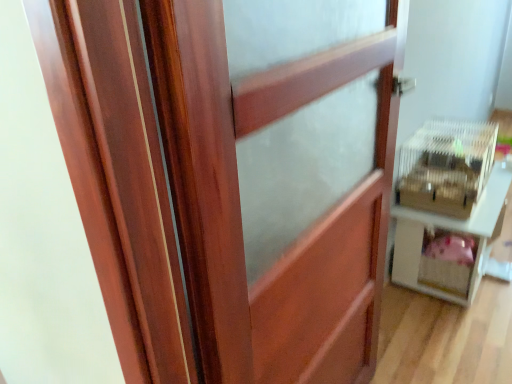
The width and height of the screenshot is (512, 384). Describe the element at coordinates (446, 166) in the screenshot. I see `clear plastic crate at right` at that location.

Identify the location of wooden barn door at center. (283, 186).

This screenshot has height=384, width=512. Find the location of `white plastic cage at right`. white plastic cage at right is located at coordinates (451, 229).

Is wooden barn door at center oriented towards white plastic cage at right?

No.

From the image's perspective, is wooden barn door at center located above or below white plastic cage at right?

Clearly, from the image's perspective, wooden barn door at center is below white plastic cage at right.

Is point (206, 295) farther from viewer compared to point (409, 274)?

No, (206, 295) is closer to viewer.

From a real-world perspective, is white plastic cage at right physically located above or below wooden barn door at center?

white plastic cage at right is situated lower than wooden barn door at center in the real world.

Can you tell me how much white plastic cage at right and wooden barn door at center differ in facing direction?

The facing directions of white plastic cage at right and wooden barn door at center are 1.28 degrees apart.

Which object is further away from the camera taking this photo, white plastic cage at right or wooden barn door at center?

white plastic cage at right is further away from the camera.

Does white plastic cage at right have a lesser width compared to wooden barn door at center?

No.

From a real-world perspective, is clear plastic crate at right physically above white plastic cage at right?

Yes, from a real-world perspective, clear plastic crate at right is above white plastic cage at right.

Is clear plastic crate at right inside or outside of white plastic cage at right?

clear plastic crate at right lies outside white plastic cage at right.

Considering the points (421, 176) and (407, 277), which point is behind, point (421, 176) or point (407, 277)?

The point (407, 277) is behind.

Which object is positioned more to the right, clear plastic crate at right or white plastic cage at right?

white plastic cage at right.

Can you tell me how much clear plastic crate at right and wooden barn door at center differ in facing direction?

The angle between the facing direction of clear plastic crate at right and the facing direction of wooden barn door at center is 1.28 degrees.

Is clear plastic crate at right inside the boundaries of wooden barn door at center, or outside?

clear plastic crate at right is not enclosed by wooden barn door at center.

Looking at this image, from a real-world perspective, who is located lower, clear plastic crate at right or wooden barn door at center?

clear plastic crate at right.

From the image's perspective, is clear plastic crate at right over wooden barn door at center?

Yes.

Are white plastic cage at right and clear plastic crate at right making contact?

No, white plastic cage at right is not in contact with clear plastic crate at right.

Considering the positions of point (473, 219) and point (452, 150), is point (473, 219) closer or farther from the camera than point (452, 150)?

Point (473, 219) is farther from the camera than point (452, 150).

Is white plastic cage at right to the left or to the right of clear plastic crate at right in the image?

Clearly, white plastic cage at right is on the right of clear plastic crate at right in the image.

From the picture: Is white plastic cage at right shorter than clear plastic crate at right?

In fact, white plastic cage at right may be taller than clear plastic crate at right.

Can you tell me how much wooden barn door at center and clear plastic crate at right differ in facing direction?

1.28 degrees separate the facing orientations of wooden barn door at center and clear plastic crate at right.

Considering the positions of point (305, 190) and point (436, 154), is point (305, 190) closer or farther from the camera than point (436, 154)?

Point (305, 190).

Can clear plastic crate at right be found inside wooden barn door at center?

Definitely not — clear plastic crate at right is not inside wooden barn door at center.

Is wooden barn door at center smaller than clear plastic crate at right?

Incorrect, wooden barn door at center is not smaller in size than clear plastic crate at right.

Find the location of a particular element. barn door below the white plastic cage at right (from the image's perspective) is located at coordinates (283, 186).

You are a GUI agent. You are given a task and a screenshot of the screen. Output one action in this format:
    pyautogui.click(x=<x>, y=<y>)
    Task: Click on the barn door lying on the left of white plastic cage at right
    
    Given the screenshot: What is the action you would take?
    pyautogui.click(x=283, y=186)

Estimate the real-world distances between objects in this image. Which object is further from white plastic cage at right, wooden barn door at center or clear plastic crate at right?

wooden barn door at center lies further to white plastic cage at right than the other object.

Considering their positions, is white plastic cage at right positioned further to wooden barn door at center than clear plastic crate at right?

white plastic cage at right lies further to wooden barn door at center than the other object.

Looking at this image, looking at the image, which one is located closer to wooden barn door at center, clear plastic crate at right or white plastic cage at right?

Based on the image, clear plastic crate at right appears to be nearer to wooden barn door at center.

Estimate the real-world distances between objects in this image. Which object is further from clear plastic crate at right, wooden barn door at center or white plastic cage at right?

wooden barn door at center lies further to clear plastic crate at right than the other object.

Estimate the real-world distances between objects in this image. Which object is closer to white plastic cage at right, clear plastic crate at right or wooden barn door at center?

clear plastic crate at right.

Which object lies nearer to the anchor point clear plastic crate at right, white plastic cage at right or wooden barn door at center?

Based on the image, white plastic cage at right appears to be nearer to clear plastic crate at right.

Identify the location of crate between wooden barn door at center and white plastic cage at right along the z-axis. (446, 166).